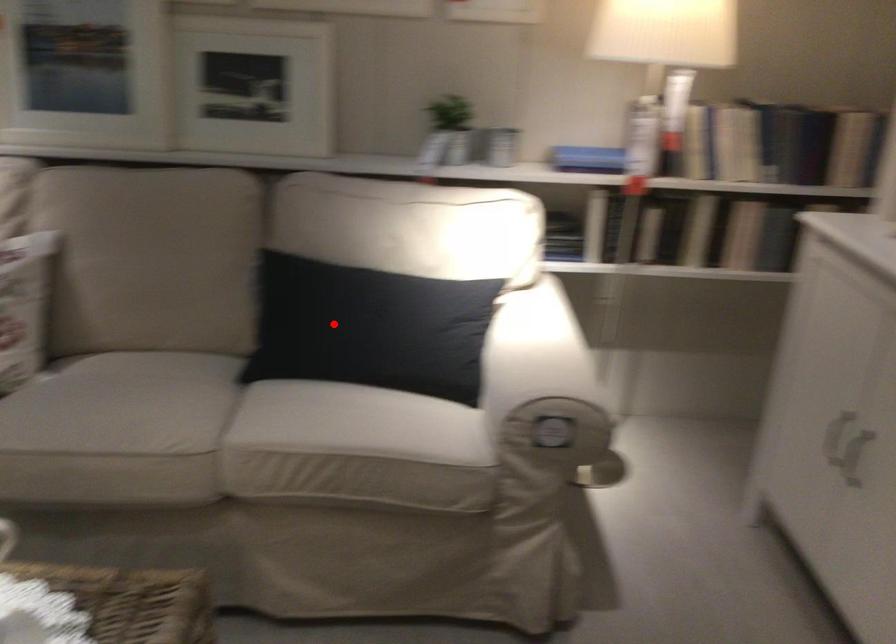
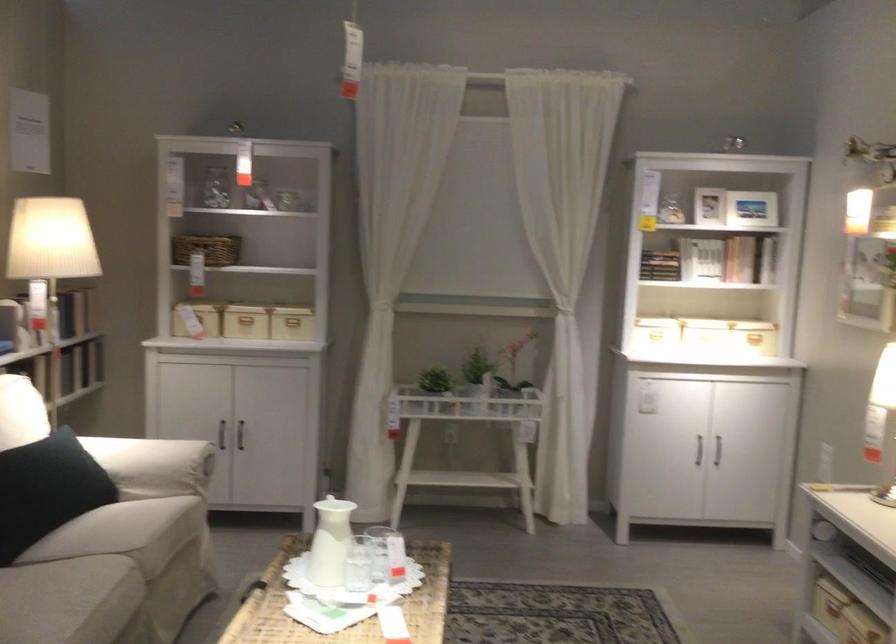
Question: I am providing you with two images of the same scene from different viewpoints. Given a red point in image1, look at the same physical point in image2. Is it:

Choices:
 (A) Closer to the viewpoint
 (B) Farther from the viewpoint

Answer: (B)